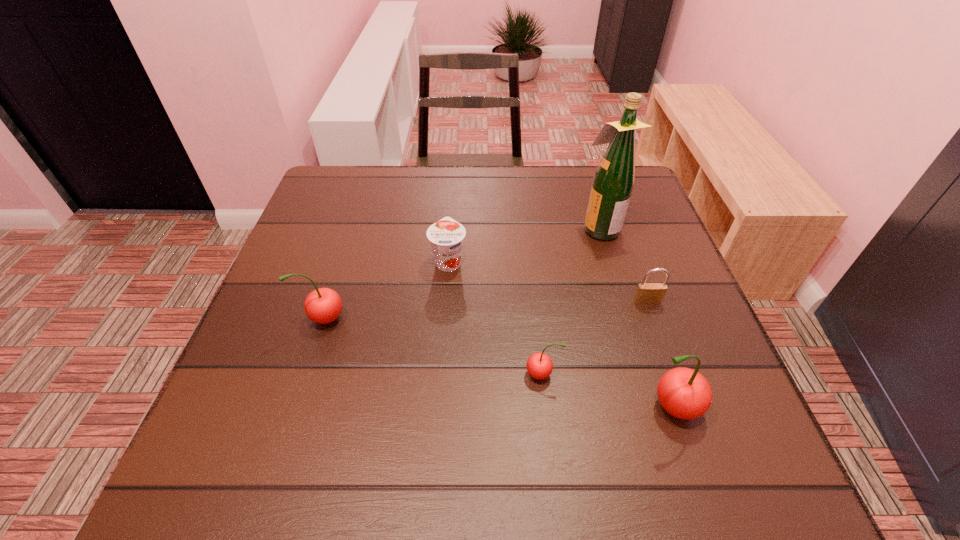
I want to click on the third nearest object, so click(323, 305).

Where is `the leftmost cherry`? The image size is (960, 540). the leftmost cherry is located at coordinates (323, 305).

Find the location of a particular element. This screenshot has width=960, height=540. the third object from left to right is located at coordinates (539, 365).

Find the location of `the second cherry from left to right`. the second cherry from left to right is located at coordinates (539, 365).

Find the location of `the nearest cherry`. the nearest cherry is located at coordinates (684, 393).

Image resolution: width=960 pixels, height=540 pixels. I want to click on the nearest object, so click(x=684, y=393).

At what (x,y) coordinates should I click in order to perform the action: click on padlock. Please return your answer as a coordinate pair (x, y). Image resolution: width=960 pixels, height=540 pixels. Looking at the image, I should click on (647, 293).

Where is `the tallest object`? the tallest object is located at coordinates (613, 182).

This screenshot has width=960, height=540. What are the coordinates of `the farthest object` in the screenshot? It's located at click(x=613, y=182).

This screenshot has width=960, height=540. I want to click on yogurt, so click(x=446, y=236).